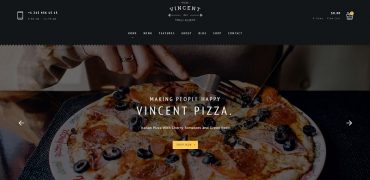
This screenshot has height=180, width=370. In order to click on the back of seat in this screenshot , I will do `click(322, 70)`.